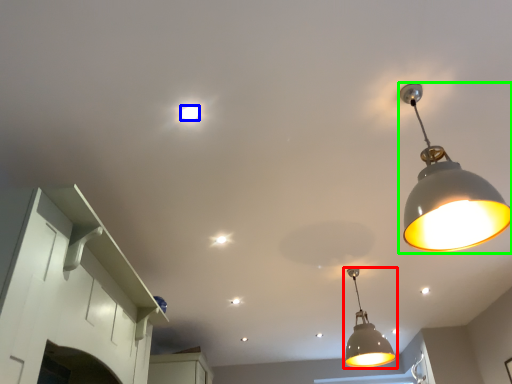
Question: Based on their relative distances, which object is nearer to lamp (highlighted by a red box)? Choose from light bulb (highlighted by a blue box) and lamp (highlighted by a green box).

Choices:
 (A) light bulb
 (B) lamp

Answer: (B)